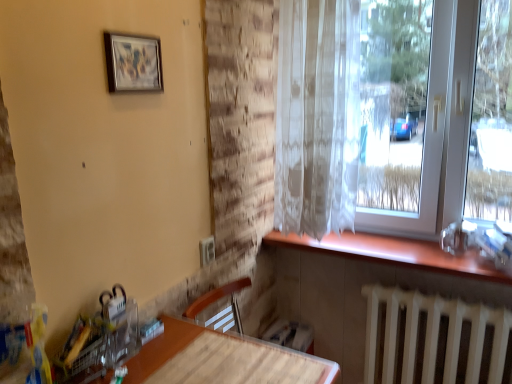
Question: From the image's perspective, is white translucent curtain at right above or below translucent white curtain at upper right?

Choices:
 (A) below
 (B) above

Answer: (B)

Question: From their relative heights in the image, would you say white translucent curtain at right is taller or shorter than translucent white curtain at upper right?

Choices:
 (A) short
 (B) tall

Answer: (B)

Question: Estimate the real-world distances between objects in this image. Which object is farther from the white metallic radiator at lower right?

Choices:
 (A) white translucent curtain at right
 (B) translucent white curtain at upper right
 (C) wooden at lower right
 (D) matte wood table at lower left
 (E) wooden table at lower center

Answer: (D)

Question: Estimate the real-world distances between objects in this image. Which object is farther from the white metallic radiator at lower right?

Choices:
 (A) matte wood table at lower left
 (B) wooden table at lower center
 (C) wooden at lower right
 (D) white translucent curtain at right
 (E) translucent white curtain at upper right

Answer: (A)